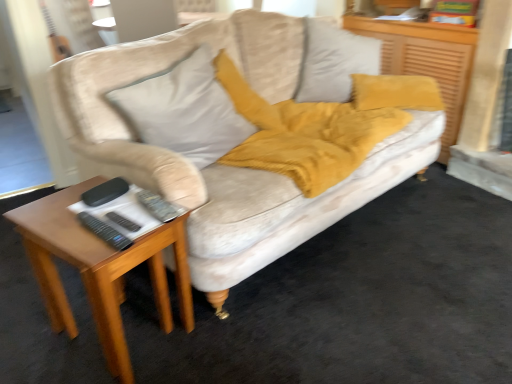
You are a GUI agent. You are given a task and a screenshot of the screen. Output one action in this format:
    pyautogui.click(x=<x>, y=<y>)
    Task: Click on the blank area beneath woodenmaterial/texturetable at left (from a real-world perspective)
    This screenshot has width=512, height=384.
    Given the screenshot: What is the action you would take?
    pyautogui.click(x=131, y=329)